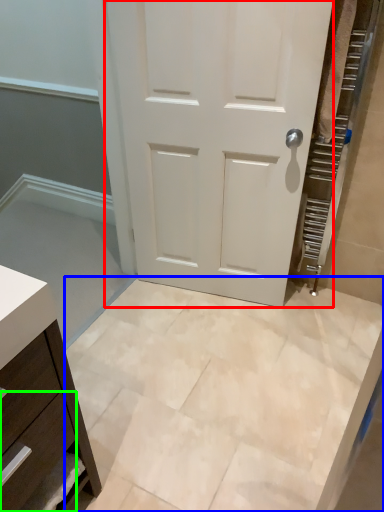
Question: Which object is positioned farthest from door (highlighted by a red box)? Select from ceramic tile (highlighted by a blue box) and drawer (highlighted by a green box).

Choices:
 (A) ceramic tile
 (B) drawer

Answer: (B)